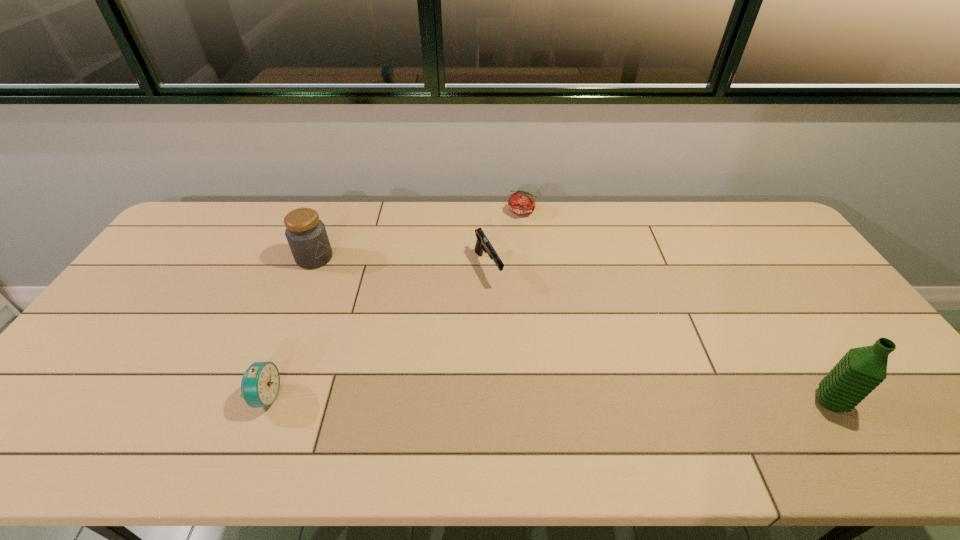
Where is `vacant space located 0.390m on the surface of the second tallest object near the warning symbol`? This screenshot has width=960, height=540. vacant space located 0.390m on the surface of the second tallest object near the warning symbol is located at coordinates (409, 329).

Locate an element on the screen. This screenshot has height=540, width=960. vacant area situated on the surface of the second tallest object near the warning symbol is located at coordinates (352, 287).

The width and height of the screenshot is (960, 540). Identify the location of vacant area situated 0.350m at the aiming end of the gun. (548, 381).

You are a GUI agent. You are given a task and a screenshot of the screen. Output one action in this format:
    pyautogui.click(x=<x>, y=<y>)
    Task: Click on the vacant region located at the aiming end of the gun
    The width and height of the screenshot is (960, 540).
    Given the screenshot: What is the action you would take?
    pyautogui.click(x=530, y=351)

I want to click on free space located at the aiming end of the gun, so click(523, 340).

Where is `free space located on the front-facing side of the tomato`? The height and width of the screenshot is (540, 960). free space located on the front-facing side of the tomato is located at coordinates (540, 251).

At what (x,y) coordinates should I click in order to perform the action: click on vacant point located 0.400m on the front-facing side of the tomato. Please return your answer as a coordinate pair (x, y). This screenshot has height=540, width=960. Looking at the image, I should click on (562, 301).

Locate an element on the screen. The width and height of the screenshot is (960, 540). vacant space located on the front-facing side of the tomato is located at coordinates (548, 271).

The height and width of the screenshot is (540, 960). I want to click on object positioned at the far edge, so click(521, 202).

This screenshot has width=960, height=540. In order to click on alarm clock positioned at the near edge in this screenshot , I will do `click(260, 384)`.